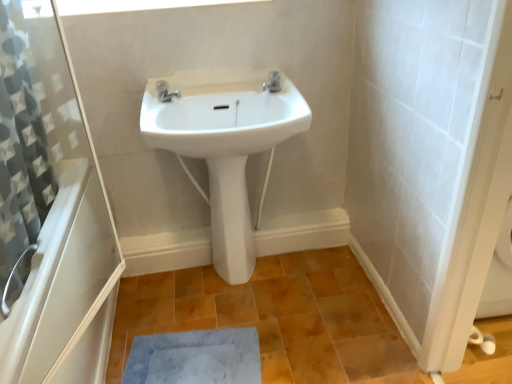
This screenshot has width=512, height=384. I want to click on spots to the right of white glossy bidet at center, so click(x=279, y=279).